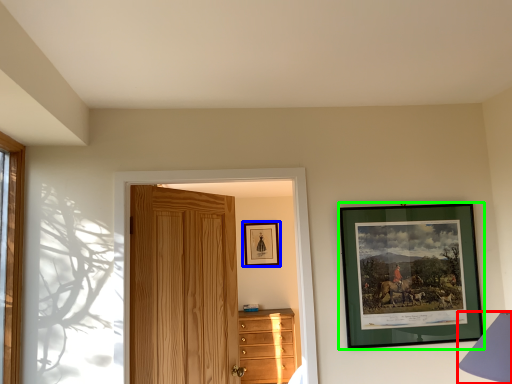
Question: Based on their relative distances, which object is farther from table lamp (highlighted by a red box)? Choose from picture frame (highlighted by a blue box) and picture frame (highlighted by a green box).

Choices:
 (A) picture frame
 (B) picture frame

Answer: (A)